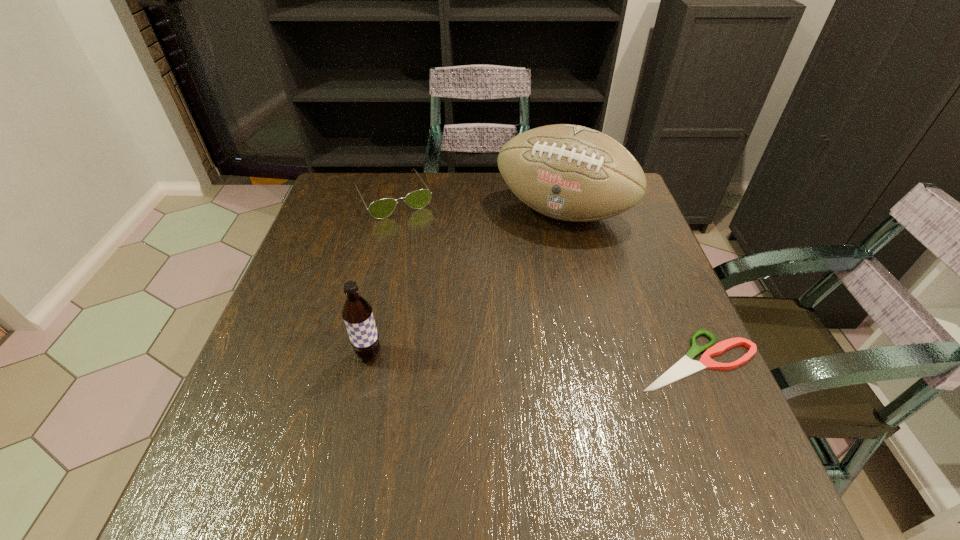
At what (x,y) coordinates should I click in order to perform the action: click on vacant region that satisfies the following two spatial constraints: 1. on the front side of the shortest object; 2. on the left side of the root beer. Please return your answer as a coordinate pair (x, y). Looking at the image, I should click on (368, 360).

Locate an element on the screen. free space in the image that satisfies the following two spatial constraints: 1. on the front side of the shortest object; 2. on the left side of the football (American) is located at coordinates (597, 360).

Find the location of `free location that satisfies the following two spatial constraints: 1. on the front side of the sunglasses; 2. on the left side of the scissors`. free location that satisfies the following two spatial constraints: 1. on the front side of the sunglasses; 2. on the left side of the scissors is located at coordinates (352, 360).

Identify the location of vacant space that satisfies the following two spatial constraints: 1. on the front side of the third shortest object; 2. on the left side of the shortest object. The image size is (960, 540). (368, 360).